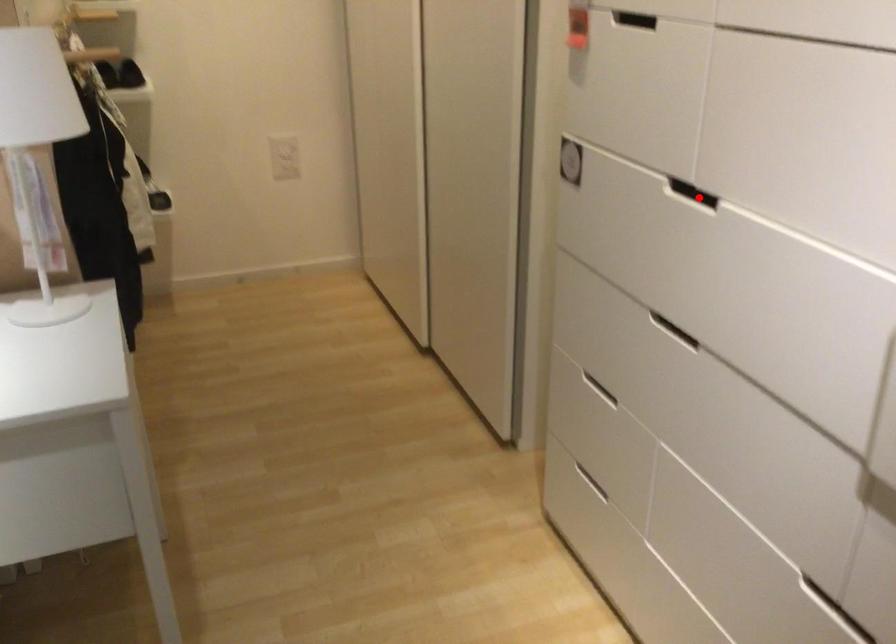
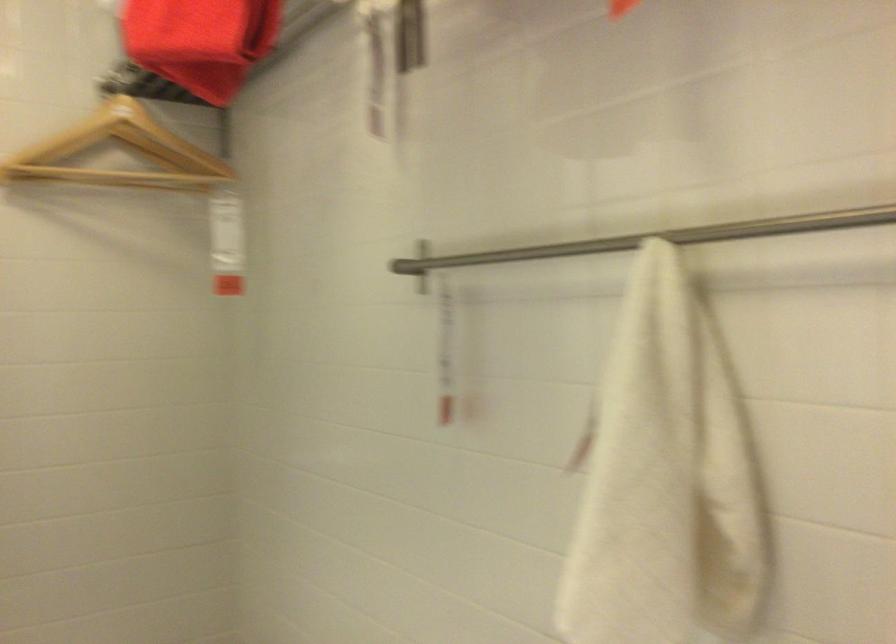
Question: I am providing you with two images of the same scene from different viewpoints. A red point is marked on the first image. Is the red point's position out of view in image 2?

Choices:
 (A) Yes
 (B) No

Answer: (A)